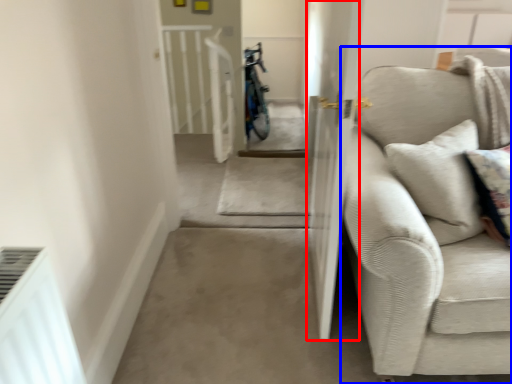
Question: Among these objects, which one is farthest to the camera, screen door (highlighted by a red box) or studio couch (highlighted by a blue box)?

Choices:
 (A) screen door
 (B) studio couch

Answer: (A)